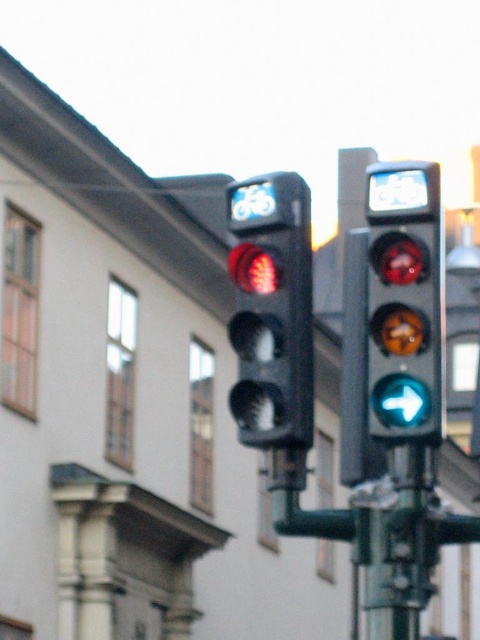
Question: Which point is farther to the camera?

Choices:
 (A) (280, 308)
 (B) (404, 412)

Answer: (A)

Question: Can you confirm if matte black traffic light at center is positioned to the right of matte glass traffic light at center?

Choices:
 (A) no
 (B) yes

Answer: (A)

Question: Does matte black traffic light at center have a lesser width compared to matte glass traffic light at center?

Choices:
 (A) yes
 (B) no

Answer: (A)

Question: Which object is closer to the camera taking this photo?

Choices:
 (A) matte black traffic light at center
 (B) matte glass traffic light at center

Answer: (B)

Question: Is matte black traffic light at center in front of matte glass traffic light at center?

Choices:
 (A) no
 (B) yes

Answer: (A)